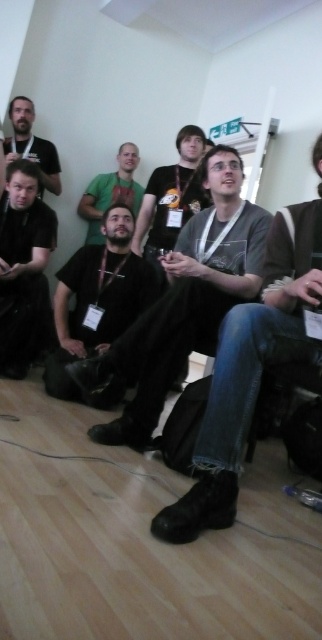
Is denim jeans at center bigger than matte black shirt at upper left?

Yes.

Can you confirm if denim jeans at center is positioned to the right of matte black shirt at upper left?

Correct, you'll find denim jeans at center to the right of matte black shirt at upper left.

The image size is (322, 640). Find the location of `denim jeans at center`. denim jeans at center is located at coordinates (251, 369).

Is matte black shirt at center wider than green fabric shirt at center?

Yes, matte black shirt at center is wider than green fabric shirt at center.

Is matte black shirt at center smaller than green fabric shirt at center?

Actually, matte black shirt at center might be larger than green fabric shirt at center.

Is point (59, 364) closer to camera compared to point (97, 189)?

Yes, it is.

Find the location of `matte black shirt at center`. matte black shirt at center is located at coordinates (97, 298).

Which of these two, matte black jacket at center or green fabric shirt at center, stands taller?

matte black jacket at center

Consider the image. Does matte black jacket at center have a larger size compared to green fabric shirt at center?

Yes, matte black jacket at center is bigger than green fabric shirt at center.

This screenshot has height=640, width=322. I want to click on matte black jacket at center, so click(x=183, y=301).

Find the location of `matte black jacket at center`. matte black jacket at center is located at coordinates (183, 301).